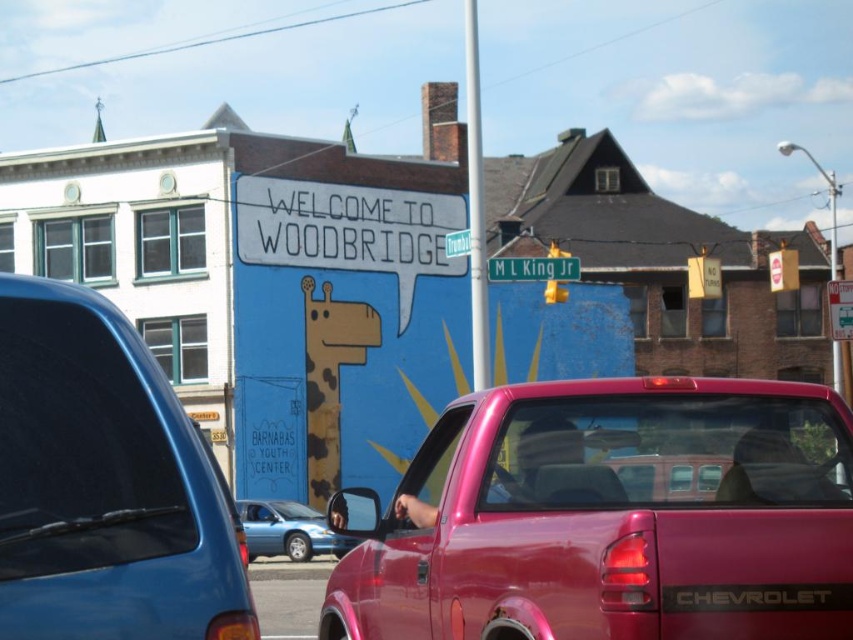
Question: Which point is farther to the camera?

Choices:
 (A) (335, 554)
 (B) (549, 260)
 (C) (729, 522)
 (D) (93, 346)

Answer: (A)

Question: Among these points, which one is nearest to the camera?

Choices:
 (A) (265, 548)
 (B) (572, 614)

Answer: (B)

Question: Which object appears farthest from the camera in this image?

Choices:
 (A) metallic pink truck at center
 (B) matte black van at left
 (C) metallic blue sedan at center

Answer: (C)

Question: Can you confirm if matte black van at left is wider than metallic blue sedan at center?

Choices:
 (A) yes
 (B) no

Answer: (B)

Question: Is metallic pink truck at center positioned before metallic blue sedan at center?

Choices:
 (A) yes
 (B) no

Answer: (A)

Question: Can you confirm if metallic blue sedan at center is positioned to the left of green metallic street sign at center?

Choices:
 (A) yes
 (B) no

Answer: (A)